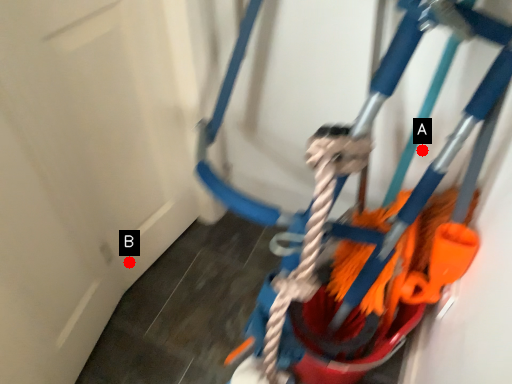
Question: Two points are circled on the image, labeled by A and B beside each circle. Which point appears farthest from the camera in this image?

Choices:
 (A) A is further
 (B) B is further

Answer: (B)